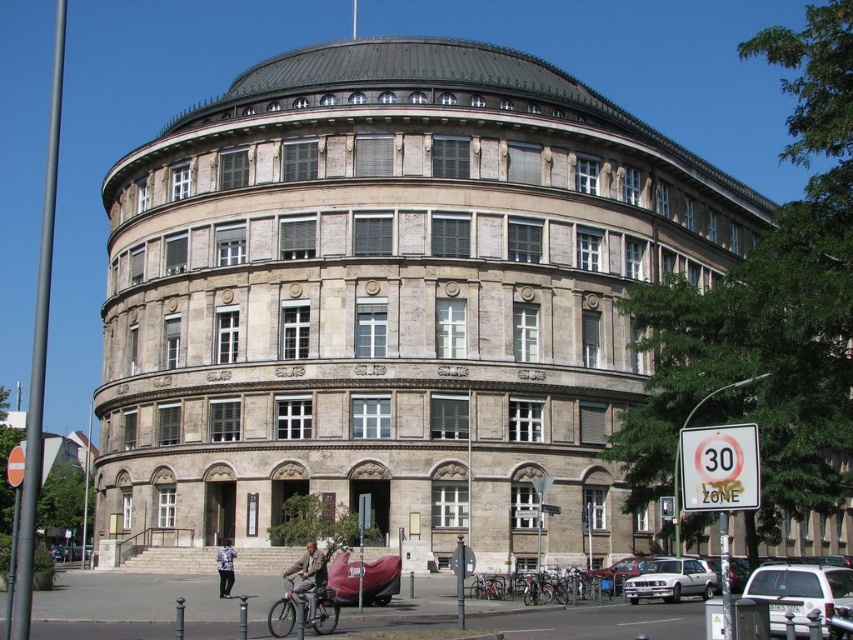
You are a delivery person needing to park your silver metallic hatchback at lower right near the entrance of the building. There is a metallic silver bicycle at lower center already parked in the area. Considering their sizes, can your hatchback fit in the available space without overlapping the bicycle?

The silver metallic hatchback at lower right is wider than the metallic silver bicycle at lower center. Since the hatchback is wider, it may not fit in the space currently occupied by the bicycle without overlapping, unless there is additional space available beyond the bicycle.

You are a delivery person trying to park your silver metallic hatchback at lower right near the entrance of the building. There is a denim jacket at lower center in the way. Can you move the denim jacket to make space for your car?

The silver metallic hatchback at lower right occupies less space than the denim jacket at lower center, so moving the denim jacket at lower center would free up enough space for the silver metallic hatchback at lower right to park.